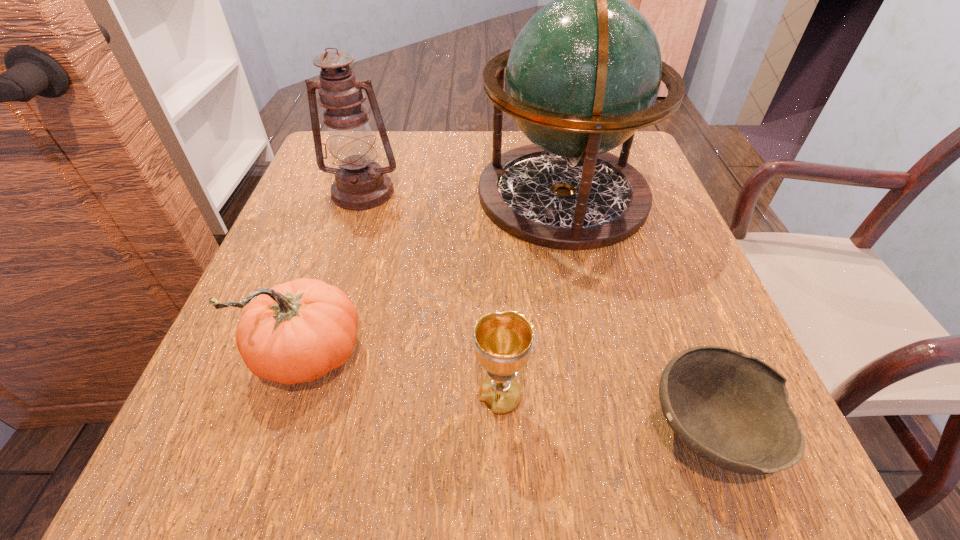
Where is `object located at the far right corner`? This screenshot has width=960, height=540. object located at the far right corner is located at coordinates (582, 76).

The image size is (960, 540). I want to click on object present at the near right corner, so click(731, 409).

I want to click on vacant space at the far edge, so click(x=429, y=174).

Locate an element on the screen. free space at the left edge of the desktop is located at coordinates (348, 259).

The height and width of the screenshot is (540, 960). In order to click on vacant space at the right edge of the desktop in this screenshot , I will do `click(640, 272)`.

Identify the location of vacant space at the far left corner of the desktop. (380, 147).

The height and width of the screenshot is (540, 960). Find the location of `vacant space at the near left corner`. vacant space at the near left corner is located at coordinates (264, 443).

What are the coordinates of `free spot between the third tallest object and the chalice` in the screenshot? It's located at point(404,377).

Locate an element on the screen. vacant area that lies between the oil lamp and the pumpkin is located at coordinates (336, 275).

The image size is (960, 540). Identify the location of empty location between the third shortest object and the chalice. (404, 377).